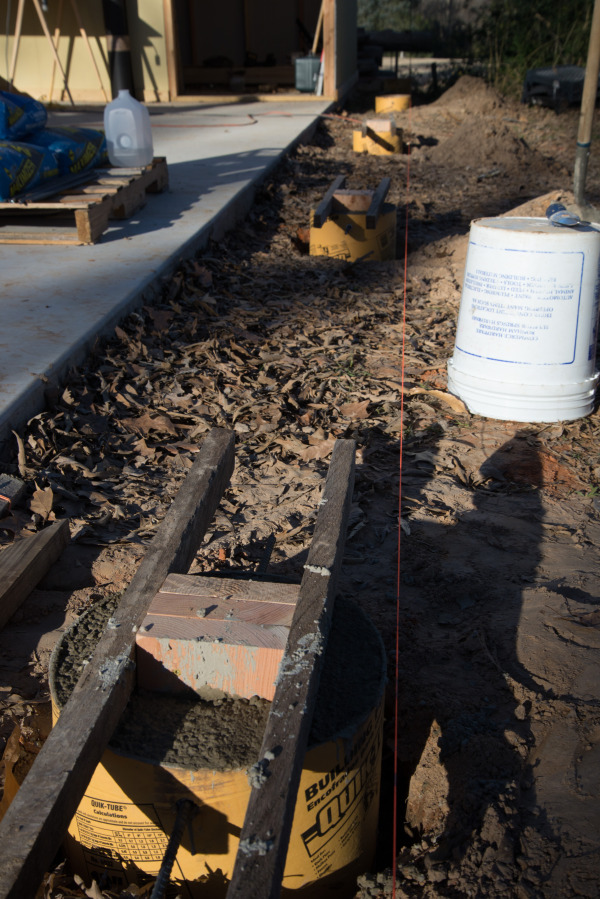
Where is `jug`? This screenshot has height=899, width=600. jug is located at coordinates (128, 138).